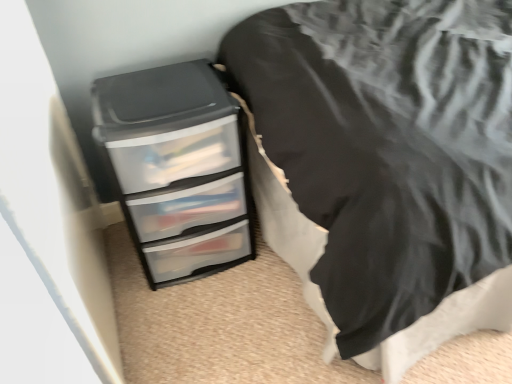
Locate an element on the screen. The height and width of the screenshot is (384, 512). clear plastic chest of drawers at lower left is located at coordinates (176, 168).

Measure the distance between clear plastic chest of drawers at lower left and camera.

clear plastic chest of drawers at lower left and camera are 3.46 feet apart from each other.

What is the approximate width of clear plastic chest of drawers at lower left?

The width of clear plastic chest of drawers at lower left is 16.37 inches.

The width and height of the screenshot is (512, 384). What do you see at coordinates (176, 168) in the screenshot? I see `clear plastic chest of drawers at lower left` at bounding box center [176, 168].

In order to face clear plastic chest of drawers at lower left, should I rotate leftwards or rightwards?

Rotate your view left by about 9.694°.

This screenshot has height=384, width=512. Find the location of `clear plastic drawers at lower left`. clear plastic drawers at lower left is located at coordinates (392, 159).

What is the approximate width of clear plastic drawers at lower left?

It is 5.23 feet.

This screenshot has height=384, width=512. Describe the element at coordinates (392, 159) in the screenshot. I see `clear plastic drawers at lower left` at that location.

The width and height of the screenshot is (512, 384). I want to click on clear plastic chest of drawers at lower left, so click(x=176, y=168).

Can you confirm if clear plastic drawers at lower left is positioned to the left of clear plastic chest of drawers at lower left?

No.

Is clear plastic drawers at lower left positioned in front of clear plastic chest of drawers at lower left?

Yes, clear plastic drawers at lower left is in front of clear plastic chest of drawers at lower left.

Is point (308, 180) closer or farther from the camera than point (148, 163)?

Point (308, 180) is closer to the camera than point (148, 163).

From the image's perspective, which one is positioned higher, clear plastic drawers at lower left or clear plastic chest of drawers at lower left?

clear plastic drawers at lower left is shown above in the image.

From a real-world perspective, is clear plastic drawers at lower left on top of clear plastic chest of drawers at lower left?

Correct, in the physical world, clear plastic drawers at lower left is higher than clear plastic chest of drawers at lower left.

Considering the relative sizes of clear plastic drawers at lower left and clear plastic chest of drawers at lower left in the image provided, is clear plastic drawers at lower left wider than clear plastic chest of drawers at lower left?

Yes, clear plastic drawers at lower left is wider than clear plastic chest of drawers at lower left.

From the picture: Between clear plastic drawers at lower left and clear plastic chest of drawers at lower left, which one has less height?

With less height is clear plastic chest of drawers at lower left.

Is clear plastic drawers at lower left bigger than clear plastic chest of drawers at lower left?

Indeed, clear plastic drawers at lower left has a larger size compared to clear plastic chest of drawers at lower left.

Is clear plastic drawers at lower left inside or outside of clear plastic chest of drawers at lower left?

clear plastic drawers at lower left is spatially situated outside clear plastic chest of drawers at lower left.

Is there a large distance between clear plastic drawers at lower left and clear plastic chest of drawers at lower left?

No, clear plastic drawers at lower left is not far away from clear plastic chest of drawers at lower left.

Is clear plastic drawers at lower left facing away from clear plastic chest of drawers at lower left?

That's not correct — clear plastic drawers at lower left is not looking away from clear plastic chest of drawers at lower left.

The height and width of the screenshot is (384, 512). Find the location of `the chest of drawers below the clear plastic drawers at lower left (from a real-world perspective)`. the chest of drawers below the clear plastic drawers at lower left (from a real-world perspective) is located at coordinates (176, 168).

Which object is positioned more to the left, clear plastic chest of drawers at lower left or clear plastic drawers at lower left?

clear plastic chest of drawers at lower left.

Is clear plastic chest of drawers at lower left positioned before clear plastic drawers at lower left?

No, it is not.

Is point (191, 279) closer to viewer compared to point (328, 287)?

That is False.

From the image's perspective, is clear plastic chest of drawers at lower left below clear plastic drawers at lower left?

Yes.

From a real-world perspective, is clear plastic chest of drawers at lower left below clear plastic drawers at lower left?

Indeed, from a real-world perspective, clear plastic chest of drawers at lower left is positioned beneath clear plastic drawers at lower left.

Considering the sizes of objects clear plastic chest of drawers at lower left and clear plastic drawers at lower left in the image provided, who is thinner, clear plastic chest of drawers at lower left or clear plastic drawers at lower left?

Thinner between the two is clear plastic chest of drawers at lower left.

Does clear plastic chest of drawers at lower left have a lesser height compared to clear plastic drawers at lower left?

Indeed, clear plastic chest of drawers at lower left has a lesser height compared to clear plastic drawers at lower left.

Who is smaller, clear plastic chest of drawers at lower left or clear plastic drawers at lower left?

Smaller between the two is clear plastic chest of drawers at lower left.

Looking at this image, is clear plastic chest of drawers at lower left positioned beyond the bounds of clear plastic drawers at lower left?

Yes.

In the scene shown: Are clear plastic chest of drawers at lower left and clear plastic drawers at lower left located far from each other?

No, there isn't a large distance between clear plastic chest of drawers at lower left and clear plastic drawers at lower left.

Is clear plastic drawers at lower left at the back of clear plastic chest of drawers at lower left?

No, clear plastic chest of drawers at lower left is not facing away from clear plastic drawers at lower left.

Could you measure the distance between clear plastic chest of drawers at lower left and clear plastic drawers at lower left?

clear plastic chest of drawers at lower left is 15.70 inches from clear plastic drawers at lower left.

Locate an element on the screen. The height and width of the screenshot is (384, 512). furniture located in front of the clear plastic chest of drawers at lower left is located at coordinates (392, 159).

Locate an element on the screen. This screenshot has height=384, width=512. chest of drawers below the clear plastic drawers at lower left (from the image's perspective) is located at coordinates (176, 168).

Where is `the chest of drawers beneath the clear plastic drawers at lower left (from a real-world perspective)`? The width and height of the screenshot is (512, 384). the chest of drawers beneath the clear plastic drawers at lower left (from a real-world perspective) is located at coordinates (176, 168).